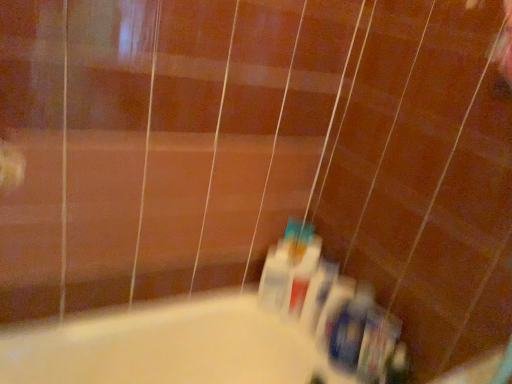
Question: Considering the relative sizes of translucent plastic toothbrushes at lower center, positioned as the 2th toiletry in left-to-right order, and white plastic toothpaste tube at center, arranged as the first toiletry when viewed from the left, in the image provided, is translucent plastic toothbrushes at lower center, positioned as the 2th toiletry in left-to-right order, shorter than white plastic toothpaste tube at center, arranged as the first toiletry when viewed from the left,?

Choices:
 (A) no
 (B) yes

Answer: (A)

Question: Is translucent plastic toothbrushes at lower center, positioned as the 2th toiletry in left-to-right order, positioned far away from white plastic toothpaste tube at center, which ranks as the 5th toiletry in right-to-left order?

Choices:
 (A) no
 (B) yes

Answer: (A)

Question: Is white plastic toothpaste tube at center, arranged as the first toiletry when viewed from the left, inside translucent plastic toothbrushes at lower center, the 4th toiletry viewed from the right?

Choices:
 (A) yes
 (B) no

Answer: (B)

Question: From the image's perspective, is translucent plastic toothbrushes at lower center, the 4th toiletry viewed from the right, under white plastic toothpaste tube at center, arranged as the first toiletry when viewed from the left?

Choices:
 (A) yes
 (B) no

Answer: (A)

Question: Does translucent plastic toothbrushes at lower center, positioned as the 2th toiletry in left-to-right order, have a larger size compared to white plastic toothpaste tube at center, arranged as the first toiletry when viewed from the left?

Choices:
 (A) no
 (B) yes

Answer: (B)

Question: Relative to translucent plastic toothbrush at center, which is the third toiletry in left-to-right order, is blue plastic toothbrush at lower right, which ranks as the 2th toiletry in right-to-left order, in front or behind?

Choices:
 (A) behind
 (B) front

Answer: (B)

Question: Is blue plastic toothbrush at lower right, which ranks as the 2th toiletry in right-to-left order, wider or thinner than translucent plastic toothbrush at center, positioned as the 3th toiletry in right-to-left order?

Choices:
 (A) wide
 (B) thin

Answer: (B)

Question: Considering the positions of point (345, 339) and point (340, 309), is point (345, 339) closer or farther from the camera than point (340, 309)?

Choices:
 (A) farther
 (B) closer

Answer: (B)

Question: Considering the relative positions of blue plastic toothbrush at lower right, which ranks as the 4th toiletry in left-to-right order, and translucent plastic toothbrush at center, which is the third toiletry in left-to-right order, in the image provided, is blue plastic toothbrush at lower right, which ranks as the 4th toiletry in left-to-right order, to the left or to the right of translucent plastic toothbrush at center, which is the third toiletry in left-to-right order,?

Choices:
 (A) right
 (B) left

Answer: (A)

Question: Does point (351, 357) appear closer or farther from the camera than point (293, 253)?

Choices:
 (A) closer
 (B) farther

Answer: (A)

Question: From the image's perspective, relative to white plastic mouthwash at lower center, is blue plastic toothbrush at lower right, which ranks as the 2th toiletry in right-to-left order, above or below?

Choices:
 (A) above
 (B) below

Answer: (B)

Question: From a real-world perspective, relative to white plastic mouthwash at lower center, is blue plastic toothbrush at lower right, which ranks as the 4th toiletry in left-to-right order, vertically above or below?

Choices:
 (A) above
 (B) below

Answer: (B)

Question: Is blue plastic toothbrush at lower right, which ranks as the 4th toiletry in left-to-right order, wider or thinner than white plastic mouthwash at lower center?

Choices:
 (A) wide
 (B) thin

Answer: (B)

Question: Is translucent plastic toothbrush at center, which is the third toiletry in left-to-right order, bigger or smaller than white plastic mouthwash at lower center?

Choices:
 (A) small
 (B) big

Answer: (A)

Question: Considering the positions of translucent plastic toothbrush at center, which is the third toiletry in left-to-right order, and white plastic mouthwash at lower center in the image, is translucent plastic toothbrush at center, which is the third toiletry in left-to-right order, wider or thinner than white plastic mouthwash at lower center?

Choices:
 (A) wide
 (B) thin

Answer: (A)